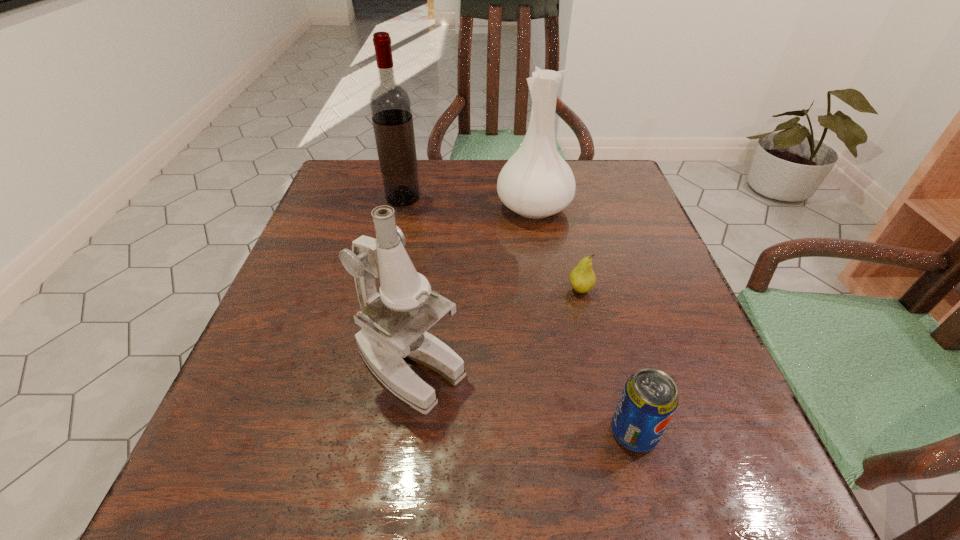
This screenshot has height=540, width=960. I want to click on vacant area between the third farthest object and the soda, so click(x=607, y=361).

Locate an element on the screen. unoccupied area between the microscope and the shortest object is located at coordinates (495, 328).

Locate an element on the screen. This screenshot has height=540, width=960. empty location between the vase and the wine bottle is located at coordinates (468, 203).

Find the location of `vacant area that lies between the wine bottle and the third nearest object`. vacant area that lies between the wine bottle and the third nearest object is located at coordinates (492, 244).

What are the coordinates of `vacant point located between the microscope and the third farthest object` in the screenshot? It's located at (495, 328).

Point out which object is positioned as the nearest to the vase. Please provide its 2D coordinates. Your answer should be formatted as a tuple, i.e. [(x, y)], where the tuple contains the x and y coordinates of a point satisfying the conditions above.

[(582, 278)]

Locate an element on the screen. The image size is (960, 540). object that stands as the closest to the third nearest object is located at coordinates (536, 182).

The width and height of the screenshot is (960, 540). Identify the location of free space in the image that satisfies the following two spatial constraints: 1. on the front side of the wine bottle; 2. on the right side of the third nearest object. pyautogui.click(x=382, y=289).

This screenshot has height=540, width=960. In order to click on free space in the image that satisfies the following two spatial constraints: 1. on the front side of the tallest object; 2. on the right side of the shortest object in this screenshot , I will do `click(382, 289)`.

You are a GUI agent. You are given a task and a screenshot of the screen. Output one action in this format:
    pyautogui.click(x=<x>, y=<y>)
    Task: Click on the free space that satisfies the following two spatial constraints: 1. on the back side of the microscope; 2. on the right side of the pear
    
    Given the screenshot: What is the action you would take?
    pyautogui.click(x=420, y=289)